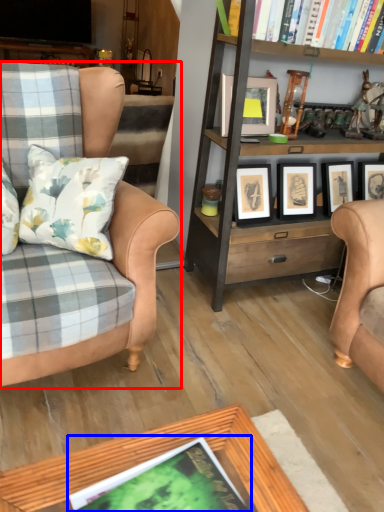
Question: Which point is further to the camera, chair (highlighted by a red box) or book (highlighted by a blue box)?

Choices:
 (A) chair
 (B) book

Answer: (A)